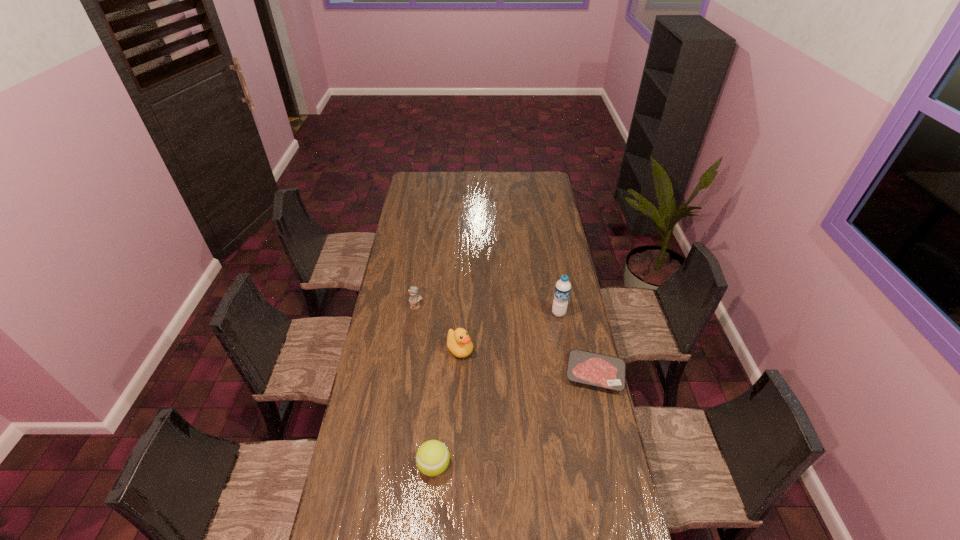
What are the coordinates of `free space located 0.100m on the front-facing side of the teddy bear` in the screenshot? It's located at (432, 323).

Where is `free space located 0.350m on the front-facing side of the teddy bear`? free space located 0.350m on the front-facing side of the teddy bear is located at coordinates (464, 361).

Locate an element on the screen. blank space located on the front-facing side of the teddy bear is located at coordinates point(426,316).

Image resolution: width=960 pixels, height=540 pixels. In order to click on free spot located at the beak of the duck in this screenshot , I will do `click(516, 401)`.

Where is `vacant point located at the beak of the duck`? The height and width of the screenshot is (540, 960). vacant point located at the beak of the duck is located at coordinates (539, 423).

Locate an element on the screen. vacant space located at the beak of the duck is located at coordinates 512,398.

Where is `object that is at the left edge`? This screenshot has width=960, height=540. object that is at the left edge is located at coordinates click(414, 298).

I want to click on steak present at the right edge, so click(584, 367).

Find the location of `water bottle present at the right edge`. water bottle present at the right edge is located at coordinates (562, 288).

In order to click on free spot at the far edge of the desktop in this screenshot , I will do `click(444, 186)`.